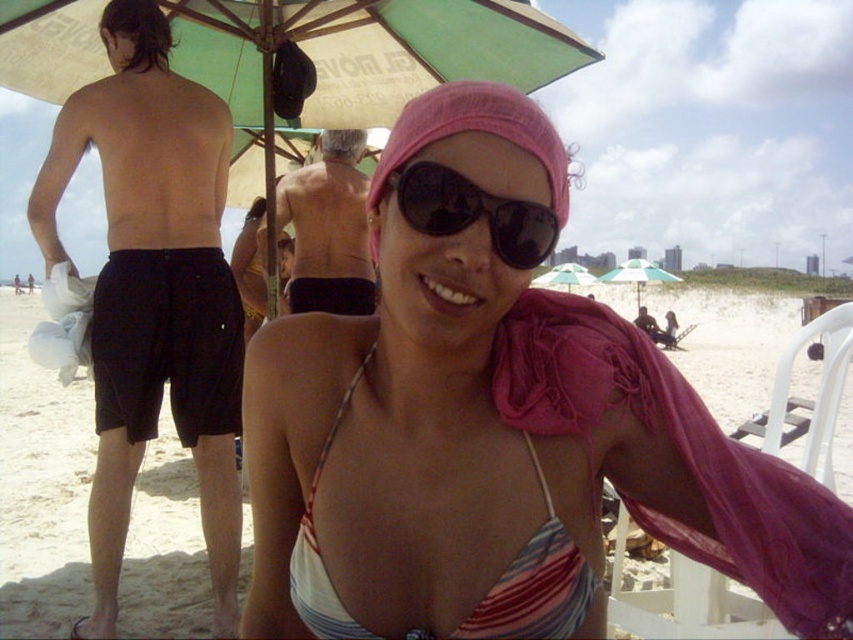
You are standing at the point labeled point (x=152, y=236) on the beach. You want to walk towards the point labeled point (x=416, y=490). Will you be moving towards the background or the foreground of the image?

Since point (x=416, y=490) is in front of point (x=152, y=236), moving towards it means you are moving toward the foreground of the image.

You are a photographer trying to capture the woman in the center. You notice the pink fabric headscarf at center and the black reflective sunglasses at center. Which object is positioned higher on her face?

The pink fabric headscarf at center has a greater height compared to the black reflective sunglasses at center, so the pink fabric headscarf at center is positioned higher on her face.

You are a photographer trying to capture a closeup of the pink fabric headscarf at center. The camera you are using has a focus point at coordinate point (474,131). Will this point be on the pink fabric headscarf at center?

Yes, the point (474,131) is on the pink fabric headscarf at center, so the focus point will be on the desired object.